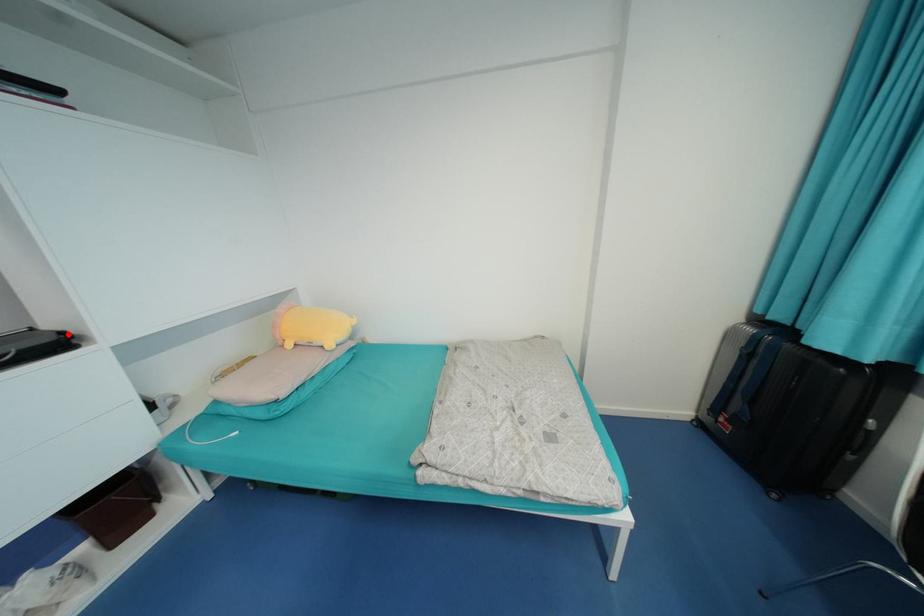
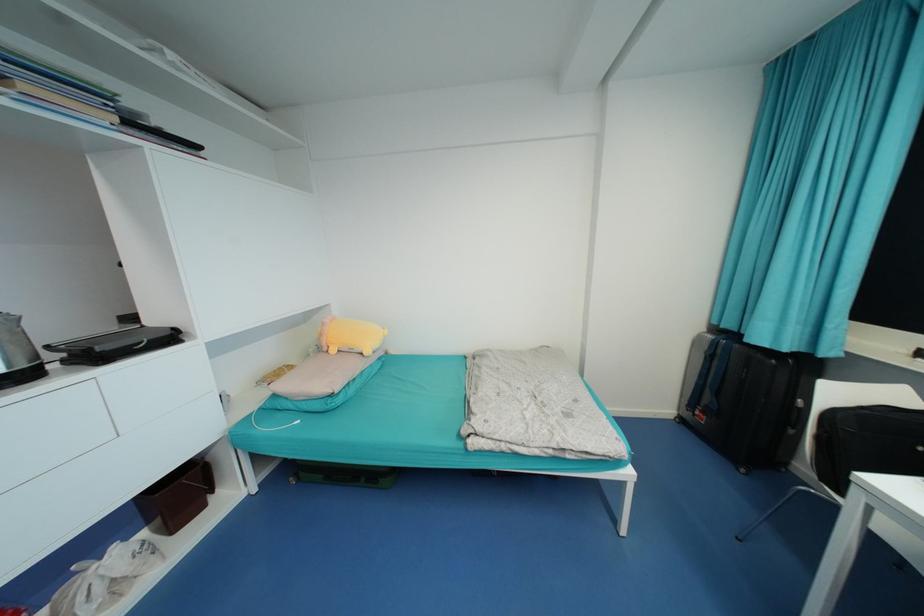
The point at the highlighted location is marked in the first image. Where is the corresponding point in the second image?

(179, 330)